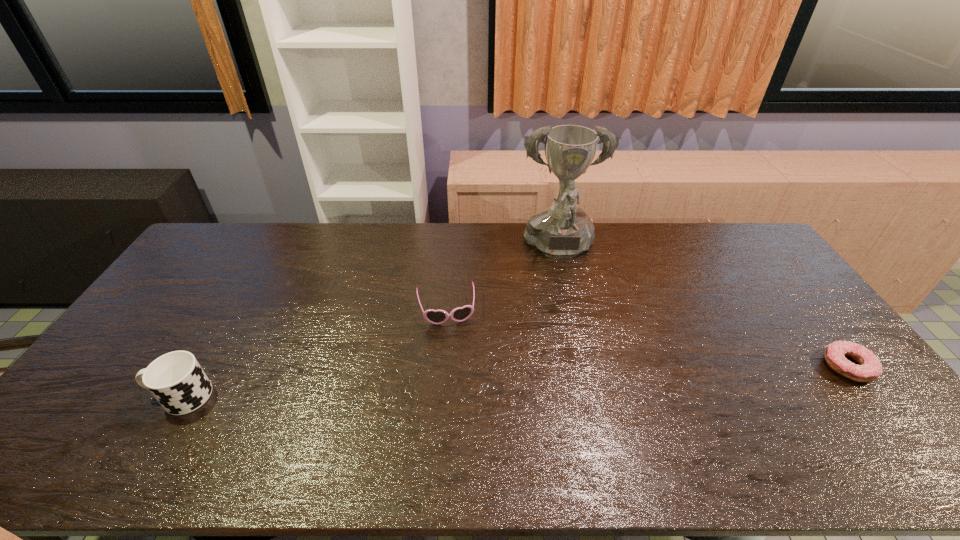
I want to click on blank space located on the side of the cup with the handle, so click(94, 396).

Identify the location of free space located on the back of the shortest object. Image resolution: width=960 pixels, height=540 pixels. (789, 292).

Identify the location of vacant space located on the front-facing side of the third tallest object. This screenshot has height=540, width=960. (454, 357).

The image size is (960, 540). I want to click on blank space located on the front-facing side of the third tallest object, so click(460, 397).

The width and height of the screenshot is (960, 540). I want to click on free space located on the front-facing side of the third tallest object, so click(x=455, y=366).

Find the location of a particular element. free location located on the side with emblem of the tallest object is located at coordinates (575, 332).

At what (x,y) coordinates should I click in order to perform the action: click on free space located on the side with emblem of the tallest object. Please return your answer as a coordinate pair (x, y). Looking at the image, I should click on (579, 353).

The image size is (960, 540). Find the location of `vacant space situated on the side with emblem of the tallest object`. vacant space situated on the side with emblem of the tallest object is located at coordinates [x=567, y=291].

At what (x,y) coordinates should I click in order to perform the action: click on object that is at the far edge. Please return your answer as a coordinate pair (x, y). Looking at the image, I should click on (562, 231).

At what (x,y) coordinates should I click in order to perform the action: click on object at the near edge. Please return your answer as a coordinate pair (x, y). The image size is (960, 540). Looking at the image, I should click on (176, 380).